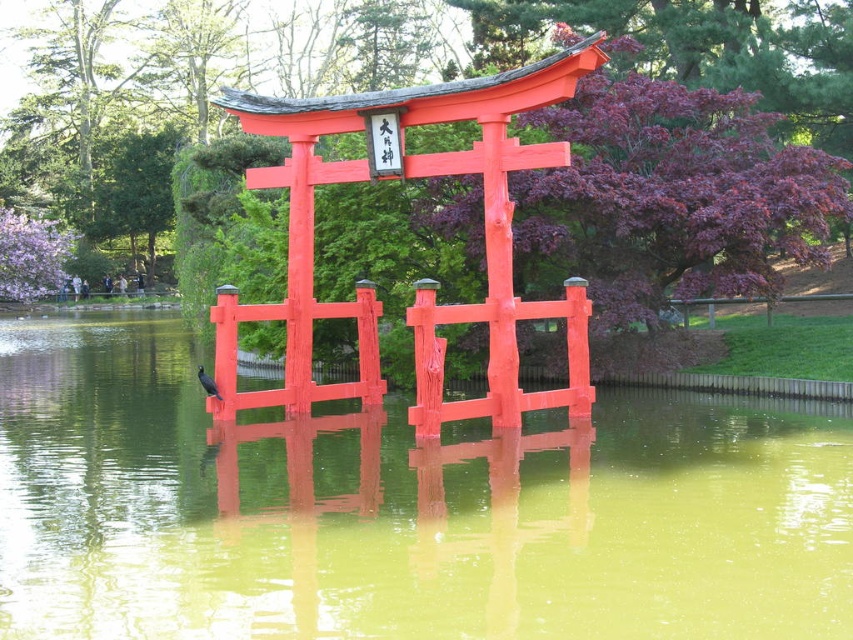
Question: Estimate the real-world distances between objects in this image. Which object is closer to the greenish water at center?

Choices:
 (A) shiny black bird at center
 (B) smooth glossy red shrine at center

Answer: (B)

Question: Does greenish water at center have a larger size compared to smooth glossy red shrine at center?

Choices:
 (A) no
 (B) yes

Answer: (A)

Question: Among these objects, which one is farthest from the camera?

Choices:
 (A) greenish water at center
 (B) smooth glossy red shrine at center
 (C) shiny black bird at center

Answer: (C)

Question: Which point appears farthest from the camera in this image?

Choices:
 (A) (523, 408)
 (B) (216, 394)

Answer: (B)

Question: Can you confirm if greenish water at center is bigger than shiny black bird at center?

Choices:
 (A) yes
 (B) no

Answer: (A)

Question: Does greenish water at center have a larger size compared to shiny black bird at center?

Choices:
 (A) yes
 (B) no

Answer: (A)